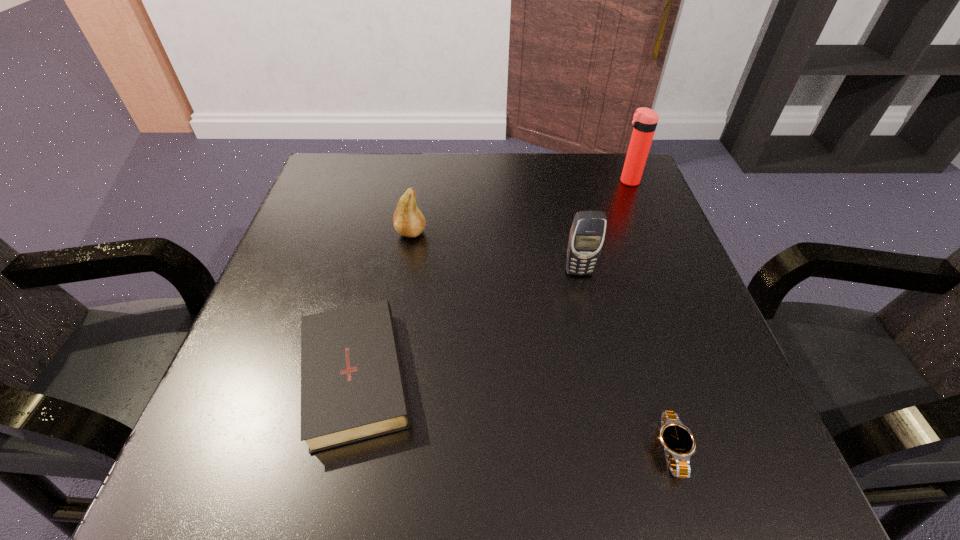
This screenshot has width=960, height=540. What are the coordinates of `object positioned at the near left corner` in the screenshot? It's located at (352, 387).

Find the location of a particular element. Image resolution: width=960 pixels, height=540 pixels. object situated at the far right corner is located at coordinates (645, 120).

Locate an element on the screen. The image size is (960, 540). object that is at the near right corner is located at coordinates (679, 443).

What are the coordinates of `vacant region at the far edge of the desktop` in the screenshot? It's located at (460, 207).

At what (x,y) coordinates should I click in order to perform the action: click on free region at the near edge of the desktop. Please return your answer as a coordinate pair (x, y). This screenshot has width=960, height=540. Looking at the image, I should click on click(x=529, y=447).

In the image, there is a desktop. At what (x,y) coordinates should I click in order to perform the action: click on vacant area at the left edge. Please return your answer as a coordinate pair (x, y). Looking at the image, I should click on (334, 219).

Identify the location of vacant space at the right edge of the desktop. This screenshot has width=960, height=540. (647, 251).

In the image, there is a desktop. Identify the location of vacant region at the far left corner. (348, 200).

Where is `free space at the near left corner`? free space at the near left corner is located at coordinates (267, 434).

Where is `free space at the far right corner`? This screenshot has height=540, width=960. free space at the far right corner is located at coordinates (613, 205).